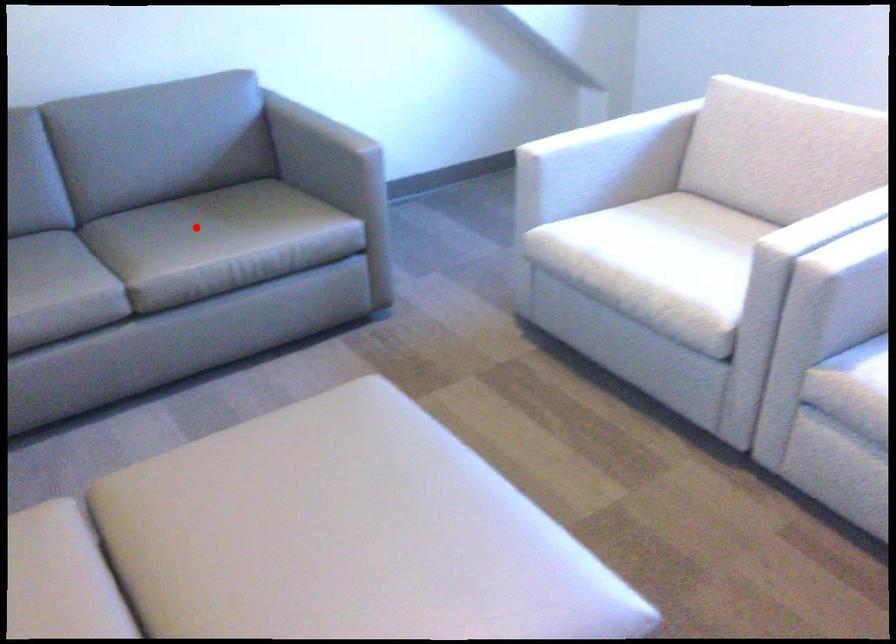
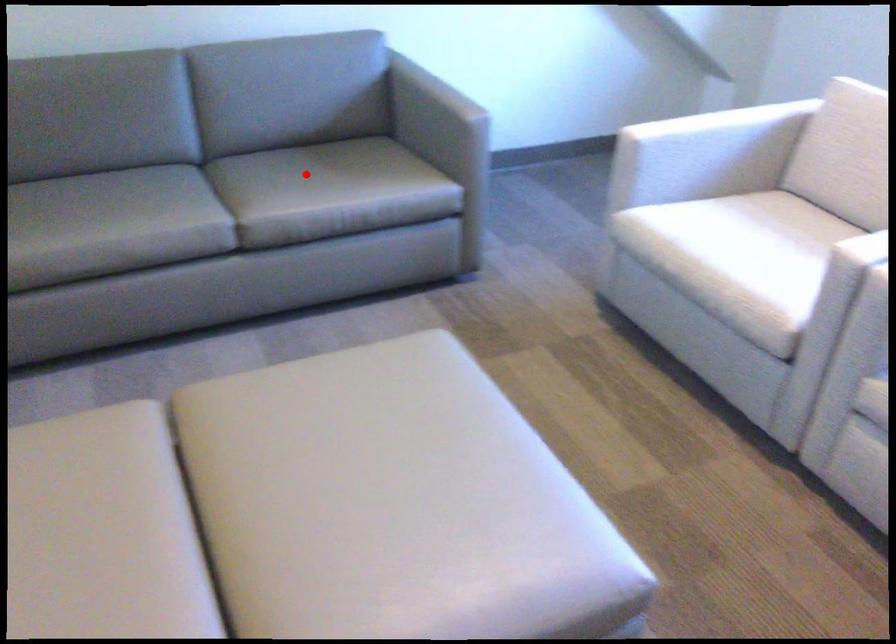
Looking at this image, I am providing you with two images of the same scene from different viewpoints. A red point is marked on the first image and another point is marked on the second image. Is the red point in image1 aligned with the point shown in image2?

Yes